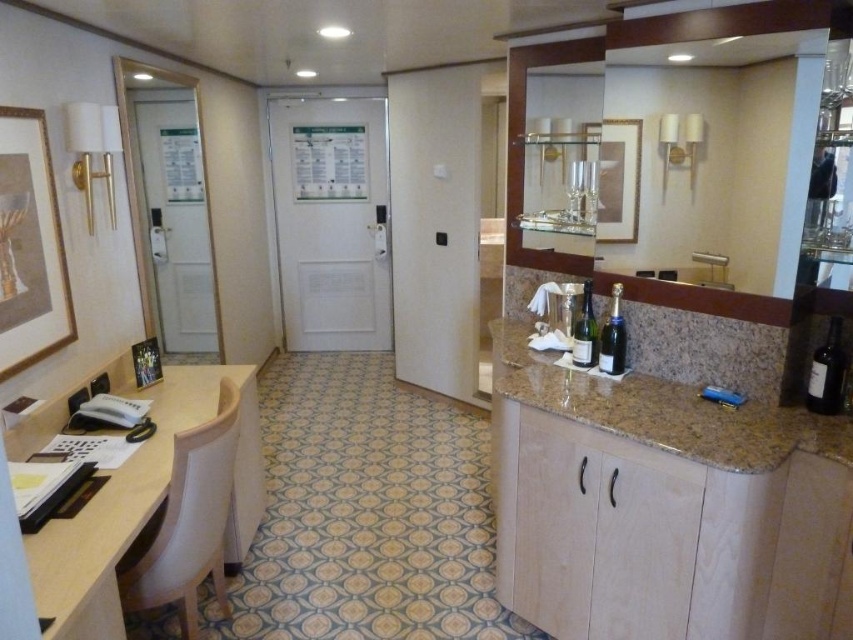
You are a hotel housekeeper who needs to move a 5.5 feet wide cleaning cart from the light wood vanity at lower left to the dark glass bottle at right. Is there enough space between them to maneuver the cart?

The distance between the light wood vanity at lower left and the dark glass bottle at right is 6.02 feet, which is wider than the 5.5 feet width of the cleaning cart. Therefore, there is sufficient space to maneuver the cart between them.